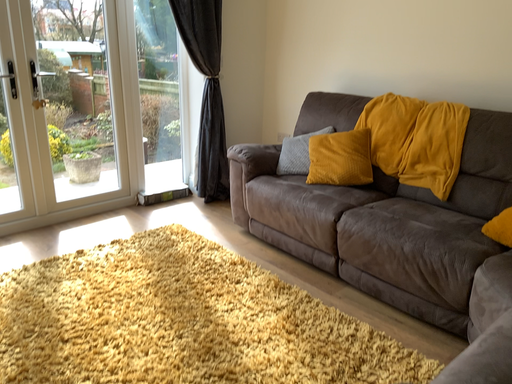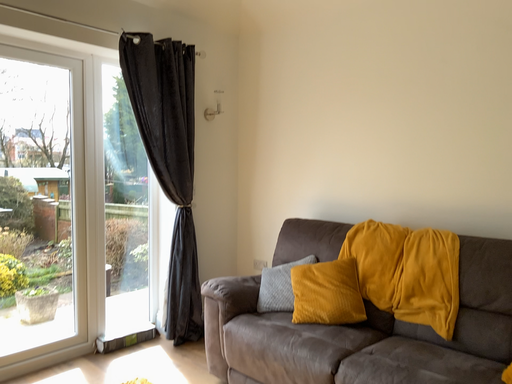
Question: How did the camera likely rotate when shooting the video?

Choices:
 (A) rotated upward
 (B) rotated downward

Answer: (A)